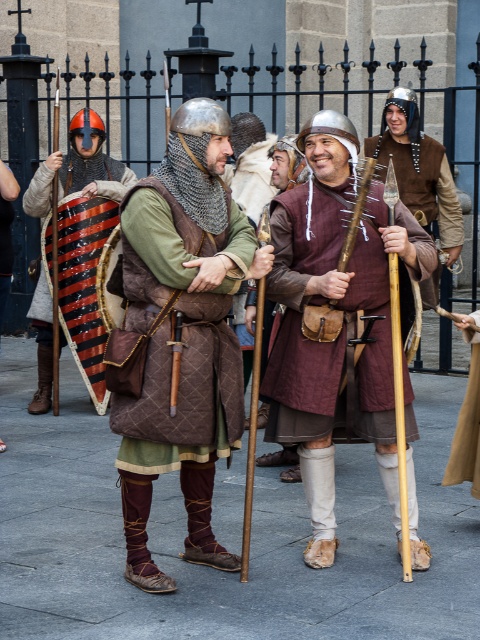
Question: Can you confirm if striped leather shield at left is wider than light brown fabric skirt at center?

Choices:
 (A) yes
 (B) no

Answer: (A)

Question: Among these points, which one is nearest to the camera?

Choices:
 (A) (384, 358)
 (B) (398, 144)
 (C) (48, 392)

Answer: (A)

Question: Considering the real-world distances, which object is farthest from the light brown fabric skirt at center?

Choices:
 (A) matte brown vest at center
 (B) brown quilted vest at center
 (C) striped leather shield at left

Answer: (C)

Question: Does brown quilted vest at center have a smaller size compared to light brown fabric skirt at center?

Choices:
 (A) yes
 (B) no

Answer: (B)

Question: Does maroon quilted tunic at center have a lesser width compared to light brown fabric skirt at center?

Choices:
 (A) no
 (B) yes

Answer: (A)

Question: Which object is positioned farthest from the striped leather shield at left?

Choices:
 (A) maroon quilted tunic at center
 (B) brown quilted vest at center
 (C) matte brown vest at center

Answer: (C)